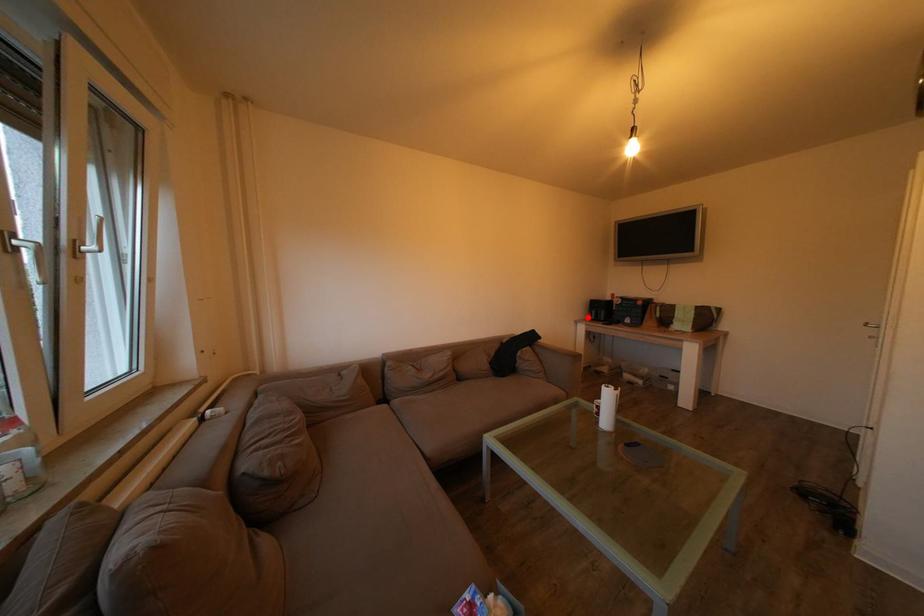
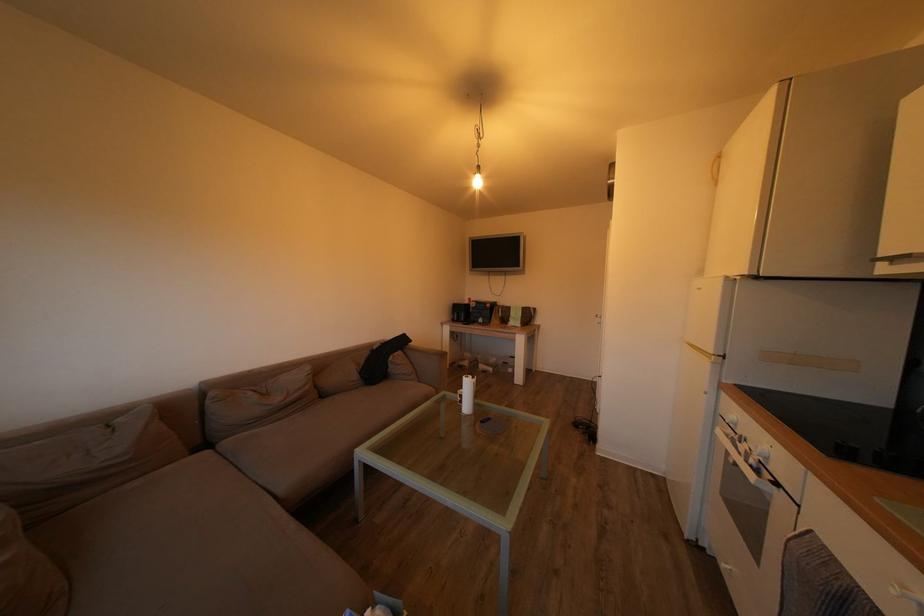
Question: I am providing you with two images of the same scene from different viewpoints. A red point is shown in image1. For the corresponding object point in image2, is it positioned nearer or farther from the camera?

Choices:
 (A) Nearer
 (B) Farther

Answer: (B)